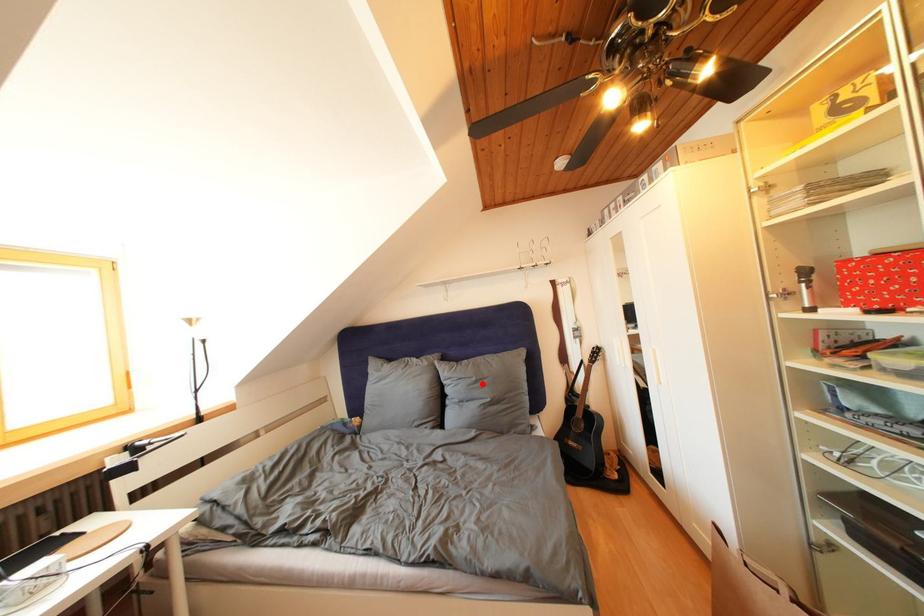
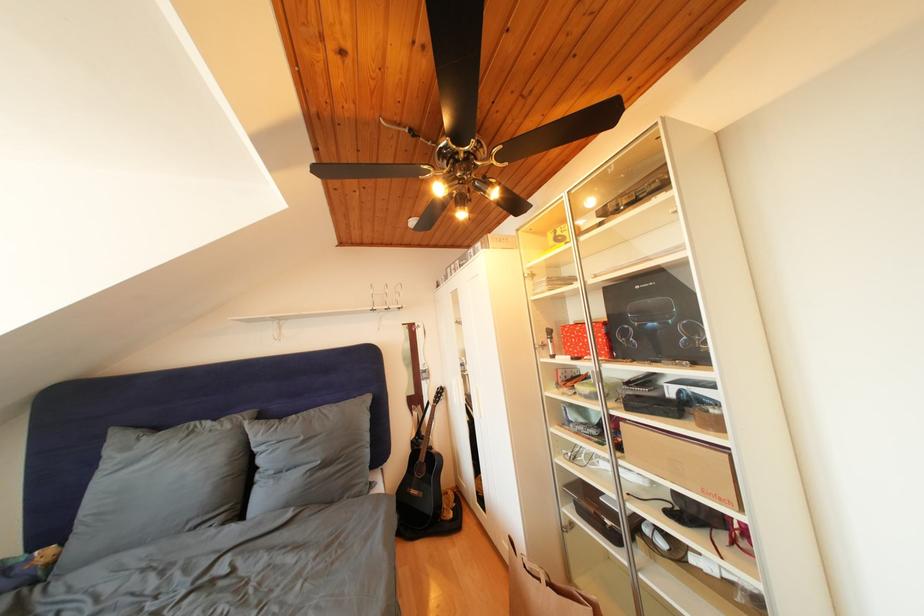
The point at the highlighted location is marked in the first image. Where is the corresponding point in the second image?

(310, 444)